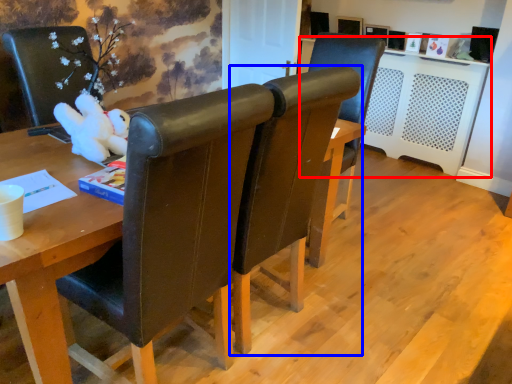
Question: Which object is closer to the camera taking this photo, computer desk (highlighted by a red box) or chair (highlighted by a blue box)?

Choices:
 (A) computer desk
 (B) chair

Answer: (B)